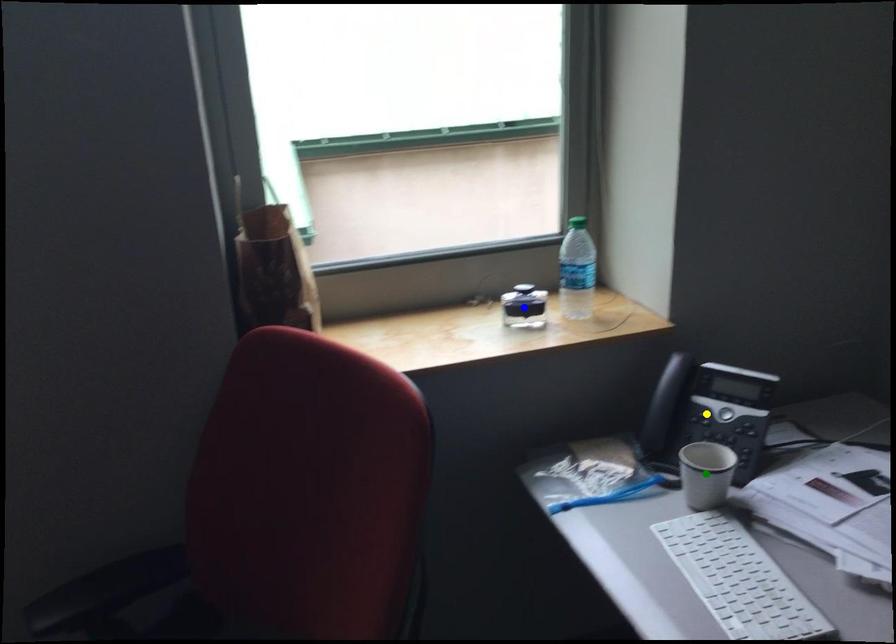
Order these from nearest to farthest:
A) green point
B) blue point
C) yellow point

green point → yellow point → blue point